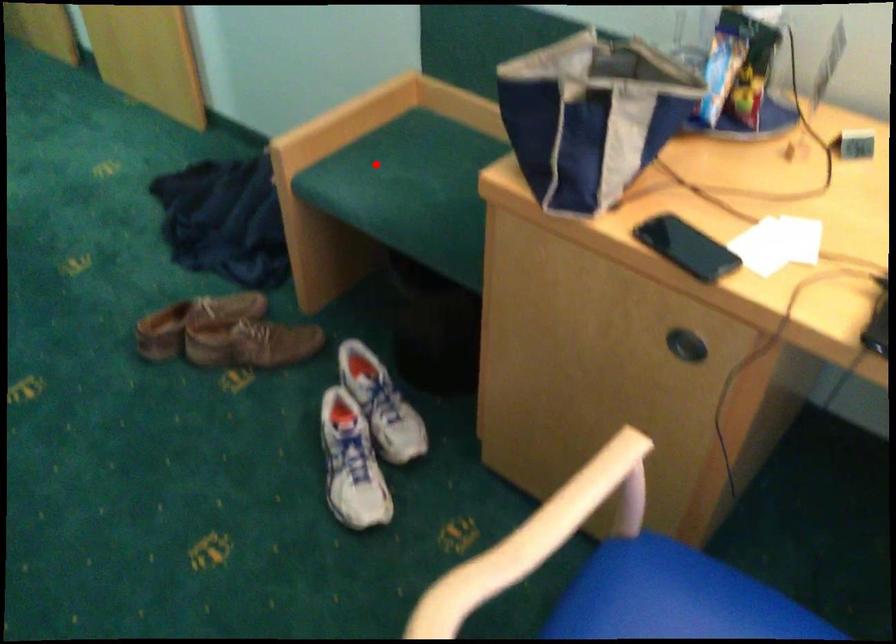
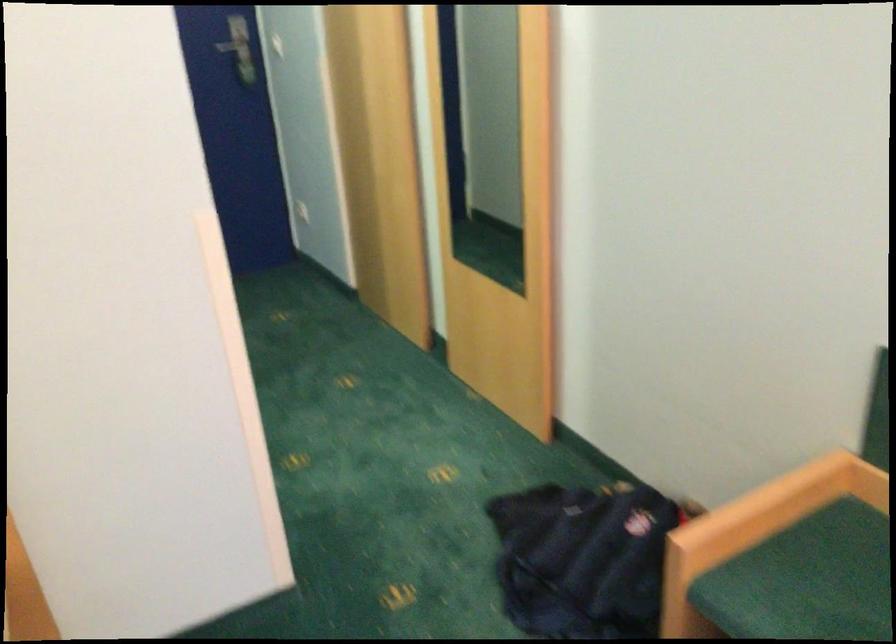
Question: I am providing you with two images of the same scene from different viewpoints. A red point is marked on the first image. Is the red point's position out of view in image 2?

Choices:
 (A) Yes
 (B) No

Answer: (B)